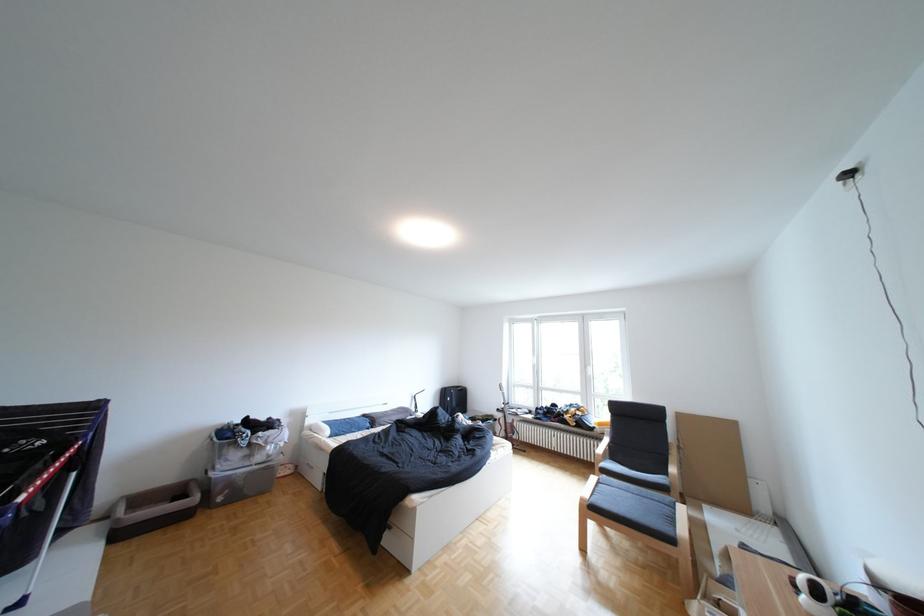
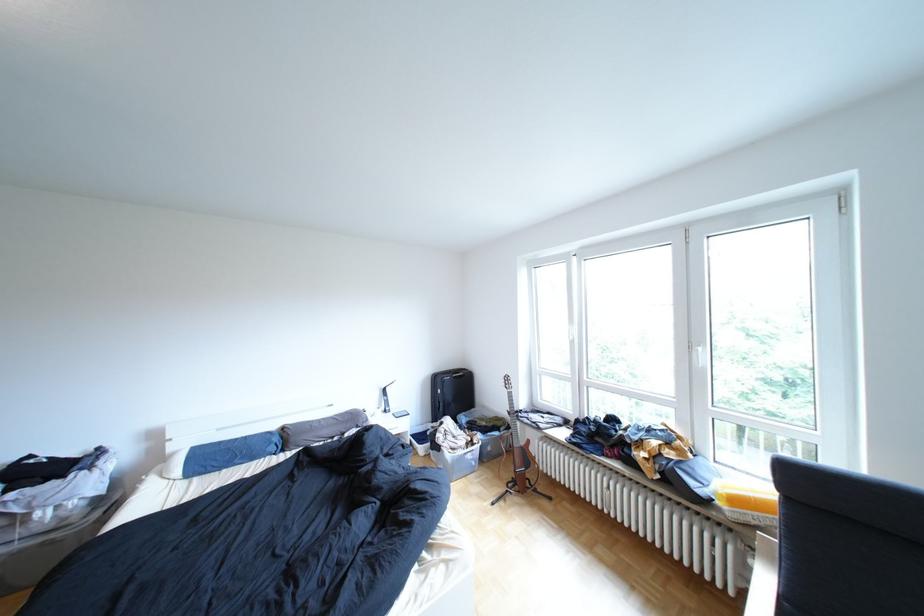
Locate, in the second image, the point that corresponds to pixel 374 415 in the first image.

(289, 427)